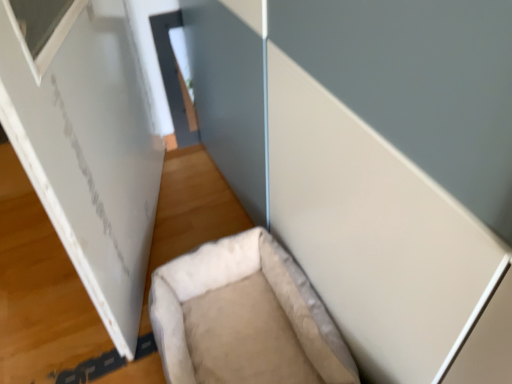
Locate an element on the screen. The image size is (512, 384). empty space that is in between white matte board at left and beige fabric pet bed at lower center is located at coordinates (190, 225).